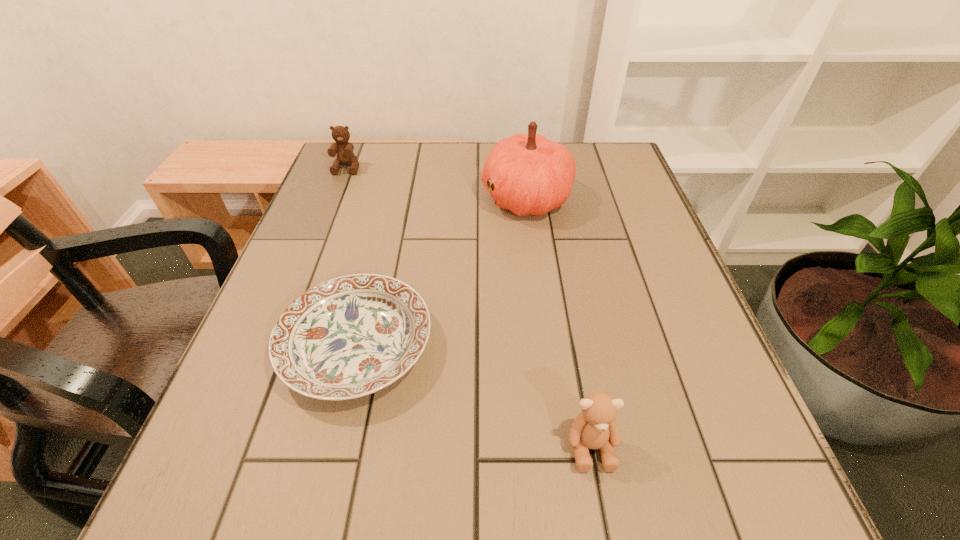
At what (x,y) coordinates should I click in order to perform the action: click on free space between the tallest object and the left teddy bear. Please return your answer as a coordinate pair (x, y). This screenshot has width=960, height=540. Looking at the image, I should click on (437, 183).

I want to click on object that ranks as the second closest to the pumpkin, so click(345, 156).

Locate an element on the screen. Image resolution: width=960 pixels, height=540 pixels. the third closest object to the nearest object is located at coordinates (345, 156).

At what (x,y) coordinates should I click in order to perform the action: click on vacant space that satisfies the following two spatial constraints: 1. on the face of the shortest object; 2. on the right side of the farther teddy bear. Please return your answer as a coordinate pair (x, y). The height and width of the screenshot is (540, 960). Looking at the image, I should click on (276, 345).

Locate an element on the screen. This screenshot has width=960, height=540. blank area in the image that satisfies the following two spatial constraints: 1. on the face of the shortest object; 2. on the left side of the left teddy bear is located at coordinates (276, 345).

In order to click on vacant point that satisfies the following two spatial constraints: 1. on the face of the shortest object; 2. on the right side of the left teddy bear in this screenshot , I will do `click(276, 345)`.